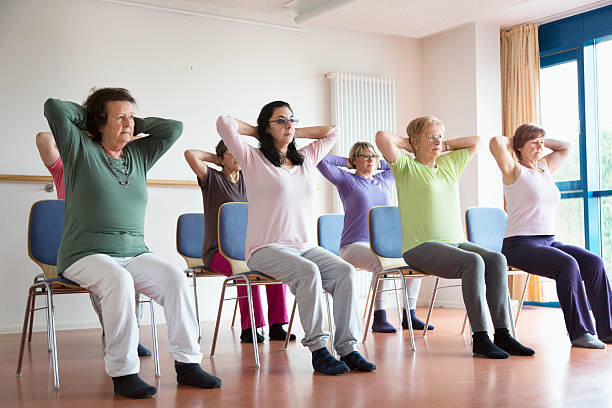
Find the location of `chair seats`. chair seats is located at coordinates (58, 281), (204, 269), (243, 274), (404, 269), (357, 271).